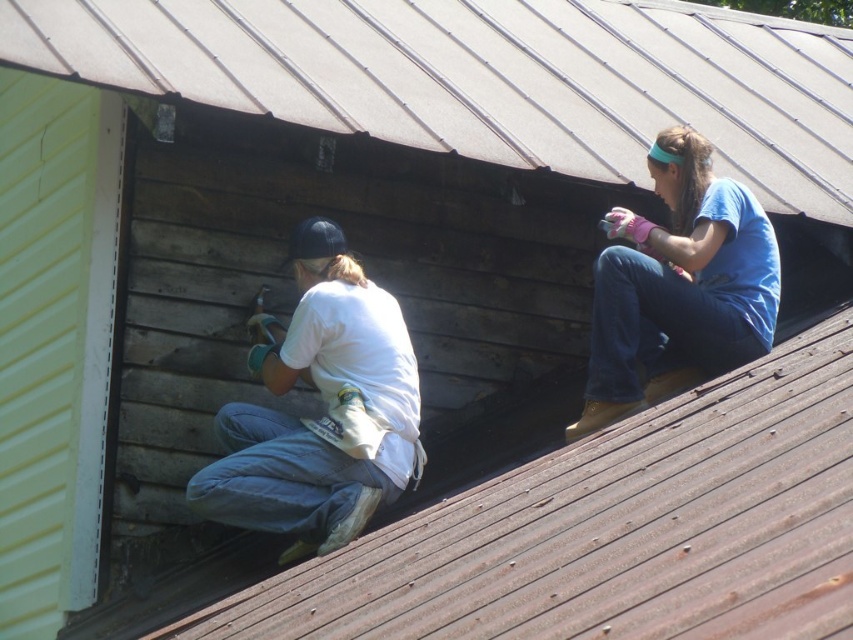
Question: Which of the following is the farthest from the observer?

Choices:
 (A) blue cotton shirt at upper right
 (B) white matte shirt at lower left

Answer: (A)

Question: Which point appears farthest from the camera in this image?

Choices:
 (A) (32, 58)
 (B) (645, 371)
 (C) (318, 248)

Answer: (B)

Question: Which point appears farthest from the camera in this image?

Choices:
 (A) (225, 483)
 (B) (602, 326)
 (C) (700, 20)

Answer: (C)

Question: Is metallic gray roof at upper center wider than white matte shirt at lower left?

Choices:
 (A) no
 (B) yes

Answer: (B)

Question: Does white matte shirt at lower left have a larger size compared to blue cotton shirt at upper right?

Choices:
 (A) yes
 (B) no

Answer: (A)

Question: Is metallic gray roof at upper center wider than blue cotton shirt at upper right?

Choices:
 (A) no
 (B) yes

Answer: (B)